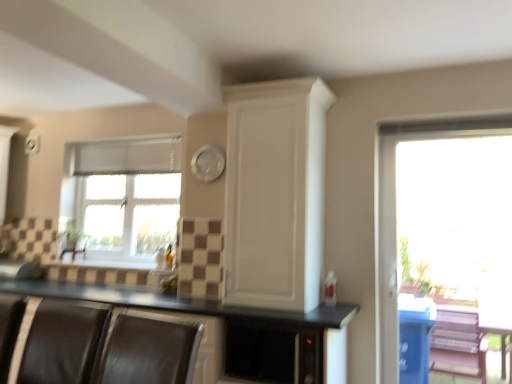
Identify the location of vacant region above white fabric blind at upper left (from a real-world perspective). coord(117,143).